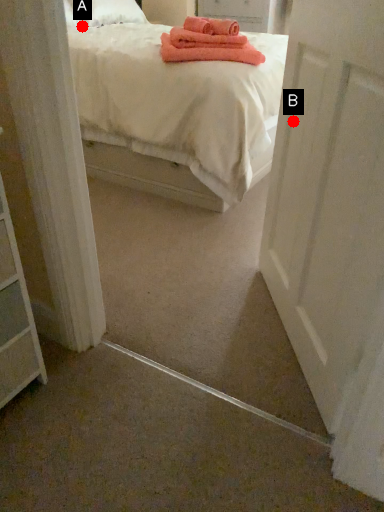
Question: Two points are circled on the image, labeled by A and B beside each circle. Among these points, which one is nearest to the camera?

Choices:
 (A) A is closer
 (B) B is closer

Answer: (B)